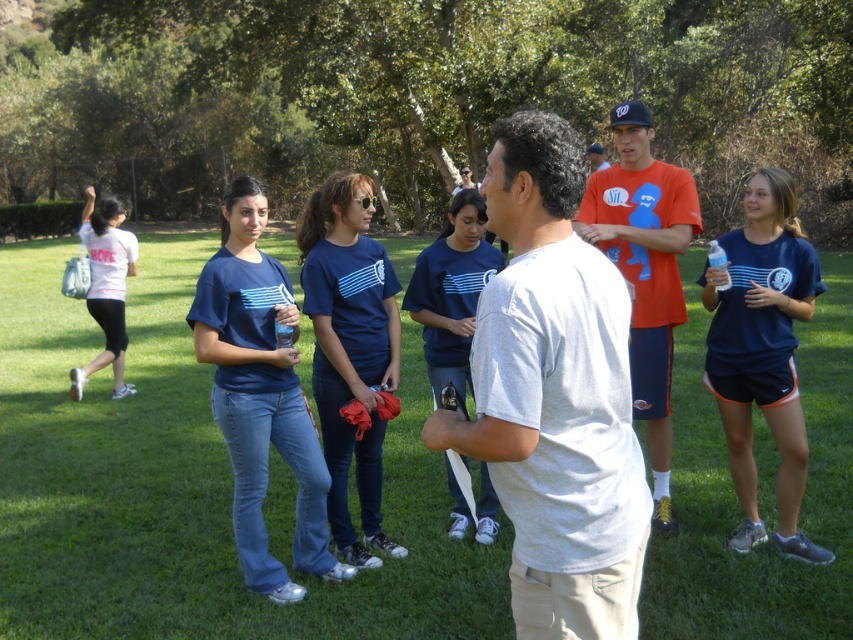
Question: Is matte blue t-shirt at center smaller than navy blue t-shirt at center?

Choices:
 (A) yes
 (B) no

Answer: (B)

Question: Which object appears farthest from the camera in this image?

Choices:
 (A) navy blue t-shirt at center
 (B) orange cotton t-shirt at upper center
 (C) matte blue t-shirt at center
 (D) orange t-shirt at center

Answer: (B)

Question: Which of the following is the farthest from the observer?

Choices:
 (A) matte blue t-shirt at center
 (B) white cotton t-shirt at center
 (C) blue fabric shirt at center

Answer: (C)

Question: Is white cotton t-shirt at center wider than blue fabric shirt at center?

Choices:
 (A) no
 (B) yes

Answer: (A)

Question: Which point is farther from the camera taking this photo?

Choices:
 (A) (267, 566)
 (B) (660, 230)

Answer: (B)

Question: Does green grass at center have a smaller size compared to white cotton t-shirt at center?

Choices:
 (A) no
 (B) yes

Answer: (A)